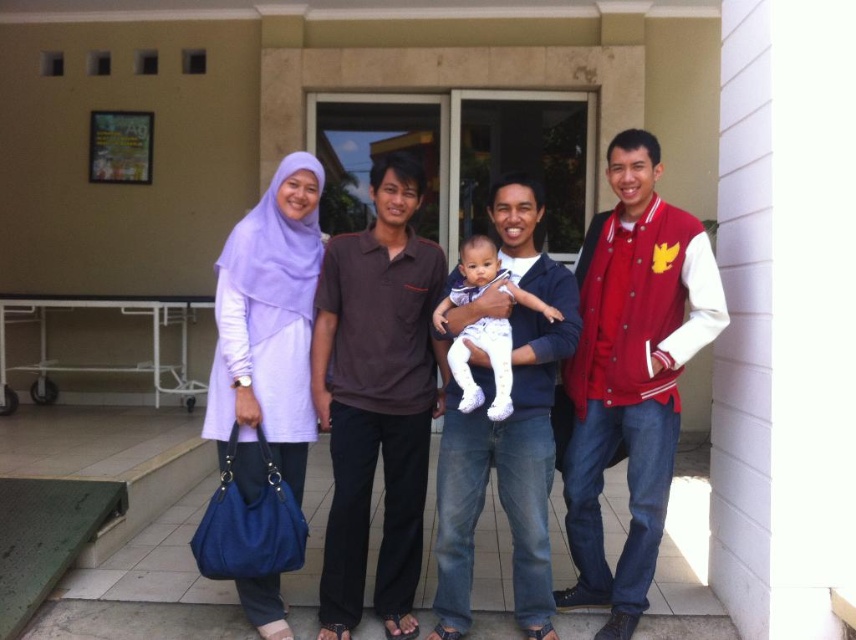
Is matte purple hijab at upper left thinner than white soft baby at center?

Incorrect, matte purple hijab at upper left's width is not less than white soft baby at center's.

Which is in front, point (542, 333) or point (467, 259)?

Point (542, 333)

What are the coordinates of `matte purple hijab at upper left` in the screenshot? It's located at (580, 394).